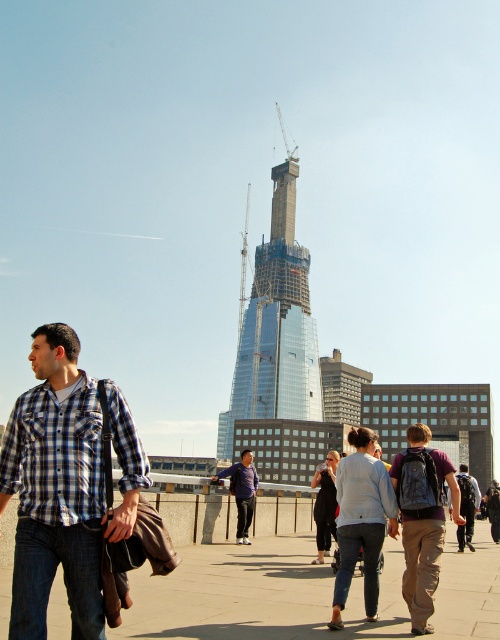
Who is shorter, glassy steel tower at center or light blue sweater at center?

Standing shorter between the two is light blue sweater at center.

Can you confirm if glassy steel tower at center is smaller than light blue sweater at center?

No, glassy steel tower at center is not smaller than light blue sweater at center.

You are a GUI agent. You are given a task and a screenshot of the screen. Output one action in this format:
    pyautogui.click(x=<x>, y=<y>)
    Task: Click on the glassy steel tower at center
    
    Given the screenshot: What is the action you would take?
    pyautogui.click(x=276, y=323)

Who is taller, glassy steel tower at center or dark blue shirt at center?

glassy steel tower at center is taller.

This screenshot has width=500, height=640. What do you see at coordinates (276, 323) in the screenshot?
I see `glassy steel tower at center` at bounding box center [276, 323].

Does point (224, 426) lie behind point (234, 465)?

Yes, point (224, 426) is farther from viewer.

Locate an element on the screen. glassy steel tower at center is located at coordinates (276, 323).

Is glassy steel tower at center above plaid cotton shirt at left?

Indeed, glassy steel tower at center is positioned over plaid cotton shirt at left.

Does point (302, 296) come in front of point (34, 410)?

No, it is behind (34, 410).

Where is `glassy steel tower at center`? Image resolution: width=500 pixels, height=640 pixels. glassy steel tower at center is located at coordinates (276, 323).